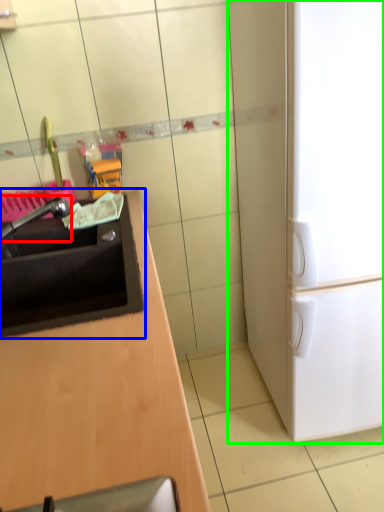
Question: Estimate the real-world distances between objects in this image. Which object is closer to faucet (highlighted by a red box), sink (highlighted by a blue box) or refrigerator (highlighted by a green box)?

Choices:
 (A) sink
 (B) refrigerator

Answer: (A)